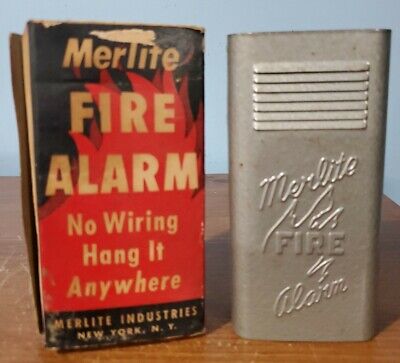
In order to click on fire alarm box in this screenshot , I will do `click(51, 61)`.